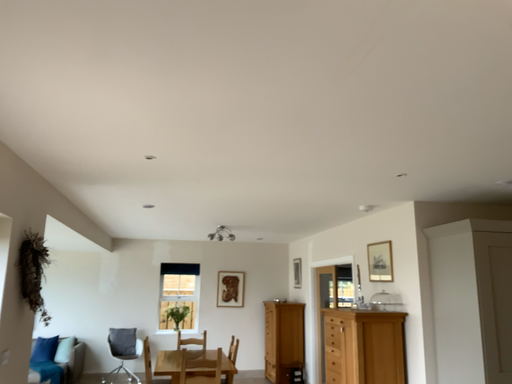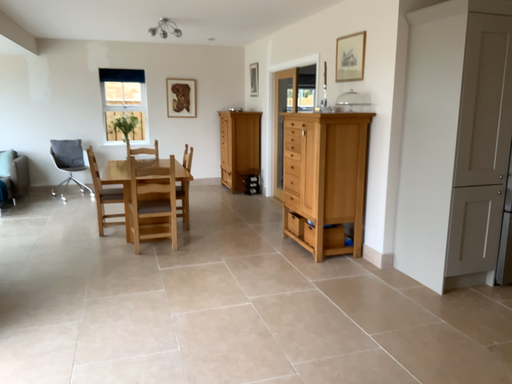
Question: Which way did the camera rotate in the video?

Choices:
 (A) rotated right
 (B) rotated left

Answer: (A)